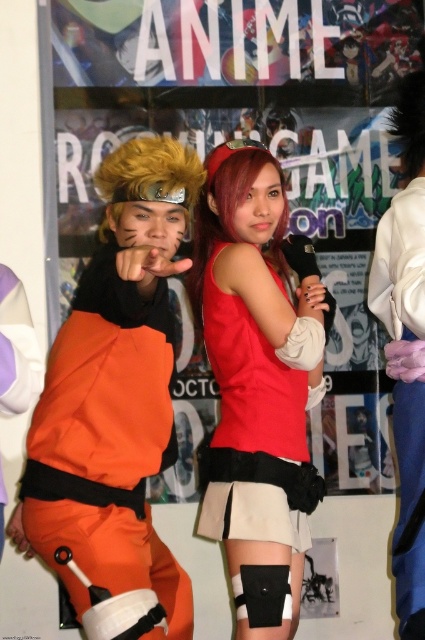
Question: Which point appears closest to the camera in this image?

Choices:
 (A) (306, 403)
 (B) (102, 563)

Answer: (B)

Question: Does orange fabric jumpsuit at center have a lesser width compared to matte red tank top at center?

Choices:
 (A) no
 (B) yes

Answer: (A)

Question: Which point appears closest to the camera in this image?

Choices:
 (A) [297, 312]
 (B) [175, 198]

Answer: (B)

Question: Can you confirm if orange fabric jumpsuit at center is thinner than matte red tank top at center?

Choices:
 (A) yes
 (B) no

Answer: (B)

Question: Is orange fabric jumpsuit at center below matte red tank top at center?

Choices:
 (A) no
 (B) yes

Answer: (A)

Question: Which point appears closest to the camera in this image?

Choices:
 (A) (285, 371)
 (B) (65, 426)

Answer: (B)